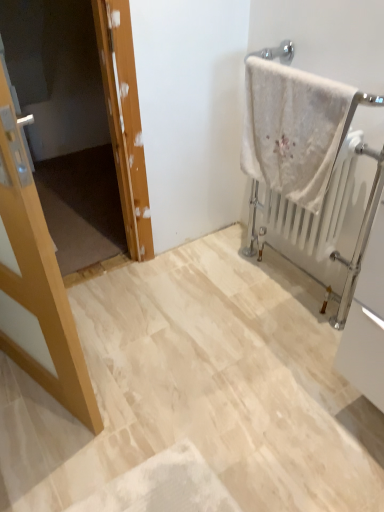
Question: Should I look upward or downward to see white fluffy towel at upper right?

Choices:
 (A) down
 (B) up

Answer: (B)

Question: Can you confirm if wooden door at left is thinner than light wood door at left?

Choices:
 (A) yes
 (B) no

Answer: (B)

Question: From the image's perspective, is wooden door at left located beneath light wood door at left?

Choices:
 (A) yes
 (B) no

Answer: (B)

Question: From the image's perspective, is wooden door at left on light wood door at left?

Choices:
 (A) no
 (B) yes

Answer: (B)

Question: Considering the relative sizes of wooden door at left and light wood door at left in the image provided, is wooden door at left bigger than light wood door at left?

Choices:
 (A) no
 (B) yes

Answer: (A)

Question: Does wooden door at left have a greater height compared to light wood door at left?

Choices:
 (A) no
 (B) yes

Answer: (A)

Question: From a real-world perspective, is wooden door at left over light wood door at left?

Choices:
 (A) no
 (B) yes

Answer: (A)

Question: Can you confirm if light wood door at left is shorter than white fluffy towel at upper right?

Choices:
 (A) no
 (B) yes

Answer: (A)

Question: Considering the relative positions of light wood door at left and white fluffy towel at upper right in the image provided, is light wood door at left to the left of white fluffy towel at upper right from the viewer's perspective?

Choices:
 (A) yes
 (B) no

Answer: (A)

Question: Is the depth of light wood door at left greater than that of white fluffy towel at upper right?

Choices:
 (A) yes
 (B) no

Answer: (B)

Question: Is the position of light wood door at left less distant than that of white fluffy towel at upper right?

Choices:
 (A) no
 (B) yes

Answer: (B)

Question: Is light wood door at left thinner than white fluffy towel at upper right?

Choices:
 (A) no
 (B) yes

Answer: (A)

Question: Could white fluffy towel at upper right be considered to be inside light wood door at left?

Choices:
 (A) no
 (B) yes

Answer: (A)

Question: From the image's perspective, does white metallic radiator at right appear higher than light wood door at left?

Choices:
 (A) yes
 (B) no

Answer: (A)